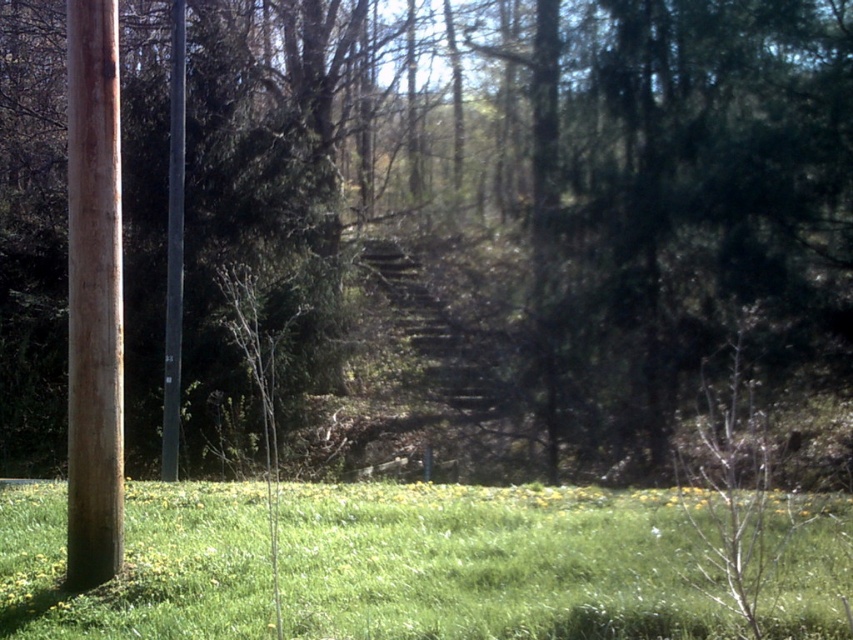
Between brown wood pole at left and black smooth pole at left, which one appears on the right side from the viewer's perspective?

Positioned to the right is brown wood pole at left.

Does brown wood pole at left lie in front of black smooth pole at left?

Yes, it is.

Where is `brown wood pole at left`? This screenshot has height=640, width=853. brown wood pole at left is located at coordinates (93, 296).

In the scene shown: Which of these two, green grassy at lower center or black smooth pole at left, stands shorter?

green grassy at lower center

Is green grassy at lower center shorter than black smooth pole at left?

Correct, green grassy at lower center is not as tall as black smooth pole at left.

Find the location of a particular element. The width and height of the screenshot is (853, 640). green grassy at lower center is located at coordinates (488, 564).

I want to click on green grassy at lower center, so click(x=488, y=564).

Looking at this image, does green grassy at lower center appear under brown wood pole at left?

Yes, green grassy at lower center is below brown wood pole at left.

Does point (672, 550) come behind point (76, 294)?

That is True.

Between point (286, 625) and point (91, 481), which one is positioned behind?

Point (91, 481)

I want to click on green grassy at lower center, so click(488, 564).